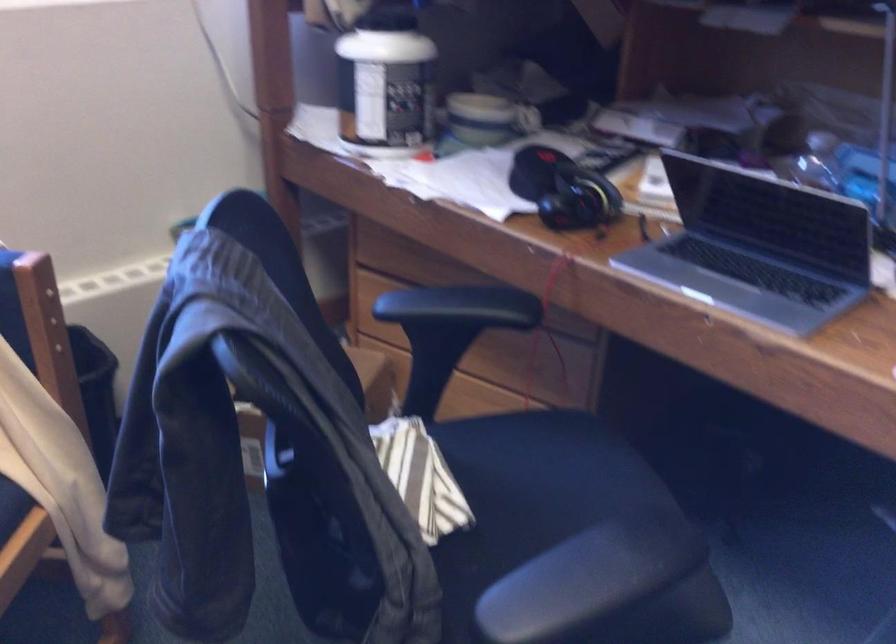
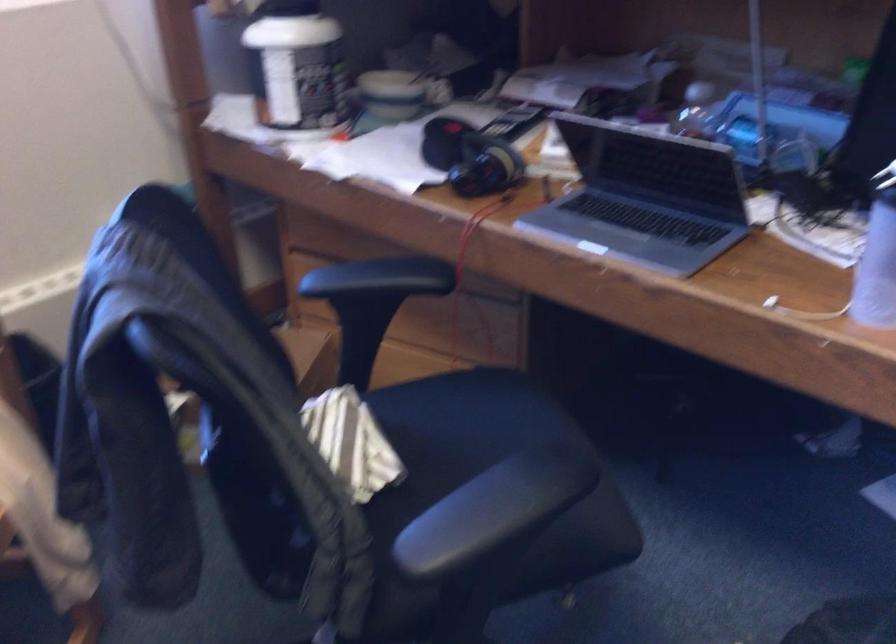
Question: The images are taken continuously from a first-person perspective. In which direction is your viewpoint rotating?

Choices:
 (A) Left
 (B) Right
 (C) Up
 (D) Down

Answer: (B)